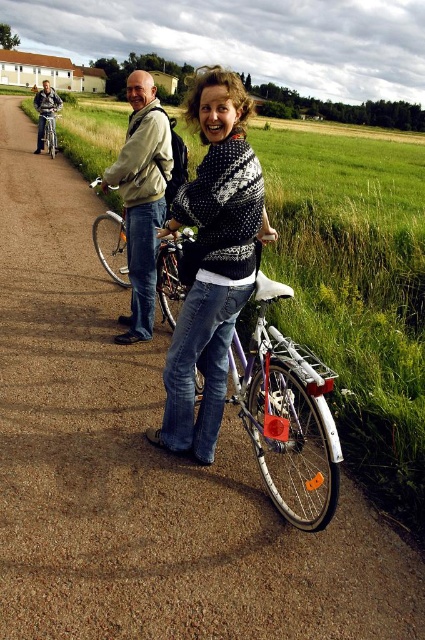
I want to click on knitted sweater at center, so click(212, 262).

Locate an element on the screen. The height and width of the screenshot is (640, 425). knitted sweater at center is located at coordinates (x=212, y=262).

How much distance is there between shiny silver bicycle at center and silver metallic bicycle at left?

34.68 feet

What do you see at coordinates (170, 275) in the screenshot?
I see `shiny silver bicycle at center` at bounding box center [170, 275].

Does point (166, 269) come closer to viewer compared to point (39, 147)?

Yes, it is.

Locate an element on the screen. This screenshot has height=640, width=425. shiny silver bicycle at center is located at coordinates (170, 275).

Is point (260, 176) positioned after point (149, 150)?

No, (260, 176) is closer to viewer.

What do you see at coordinates (212, 262) in the screenshot?
I see `knitted sweater at center` at bounding box center [212, 262].

Does point (184, 355) come behind point (136, 193)?

No, it is in front of (136, 193).

The width and height of the screenshot is (425, 640). In order to click on knitted sweater at center in this screenshot , I will do `click(212, 262)`.